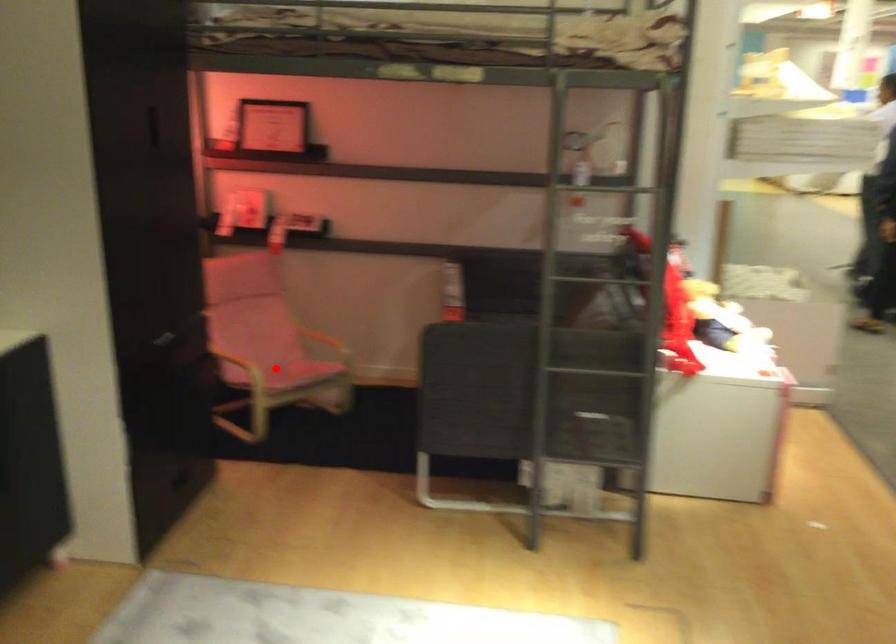
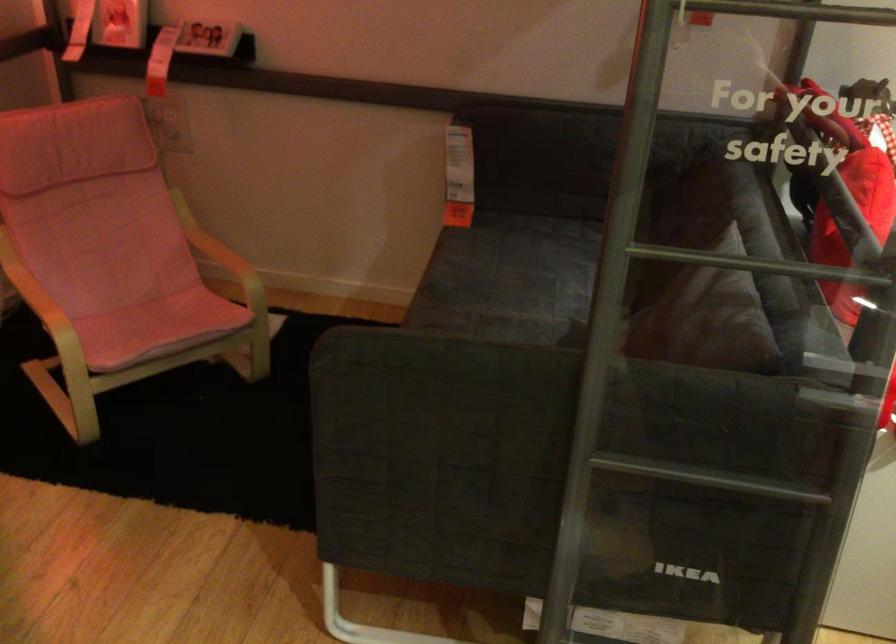
Question: I am providing you with two images of the same scene from different viewpoints. In image1, a red point is highlighted. Considering the same 3D point in image2, which of the following is correct?

Choices:
 (A) It is closer
 (B) It is farther

Answer: (A)